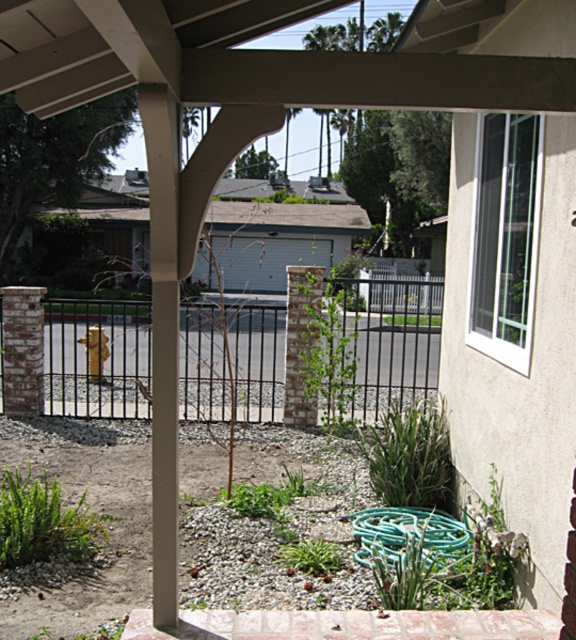
Question: Which object appears closest to the camera in this image?

Choices:
 (A) black metal fence at center
 (B) green rubber hose at lower center

Answer: (B)

Question: Is black metal fence at center thinner than green rubber hose at lower center?

Choices:
 (A) yes
 (B) no

Answer: (B)

Question: Is black metal fence at center further to camera compared to green rubber hose at lower center?

Choices:
 (A) no
 (B) yes

Answer: (B)

Question: Can you confirm if black metal fence at center is bigger than green rubber hose at lower center?

Choices:
 (A) no
 (B) yes

Answer: (B)